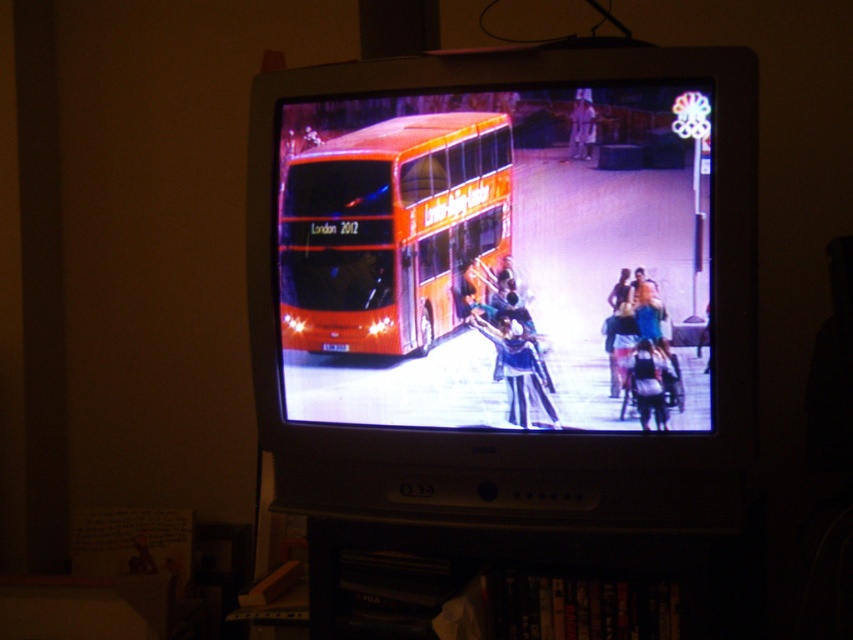
Question: Which object is the farthest from the orange matte double-decker bus at center?

Choices:
 (A) orange matte bus at center
 (B) blue fabric jacket at center

Answer: (B)

Question: Which object is positioned closest to the orange matte bus at center?

Choices:
 (A) blue fabric jacket at center
 (B) orange matte double-decker bus at center

Answer: (B)

Question: Where is orange matte double-decker bus at center located in relation to blue fabric jacket at center in the image?

Choices:
 (A) right
 (B) left

Answer: (B)

Question: Estimate the real-world distances between objects in this image. Which object is closer to the orange matte double-decker bus at center?

Choices:
 (A) orange matte bus at center
 (B) blue fabric jacket at center

Answer: (A)

Question: Can you confirm if orange matte bus at center is smaller than blue fabric jacket at center?

Choices:
 (A) no
 (B) yes

Answer: (A)

Question: Does orange matte bus at center have a greater width compared to blue fabric jacket at center?

Choices:
 (A) yes
 (B) no

Answer: (A)